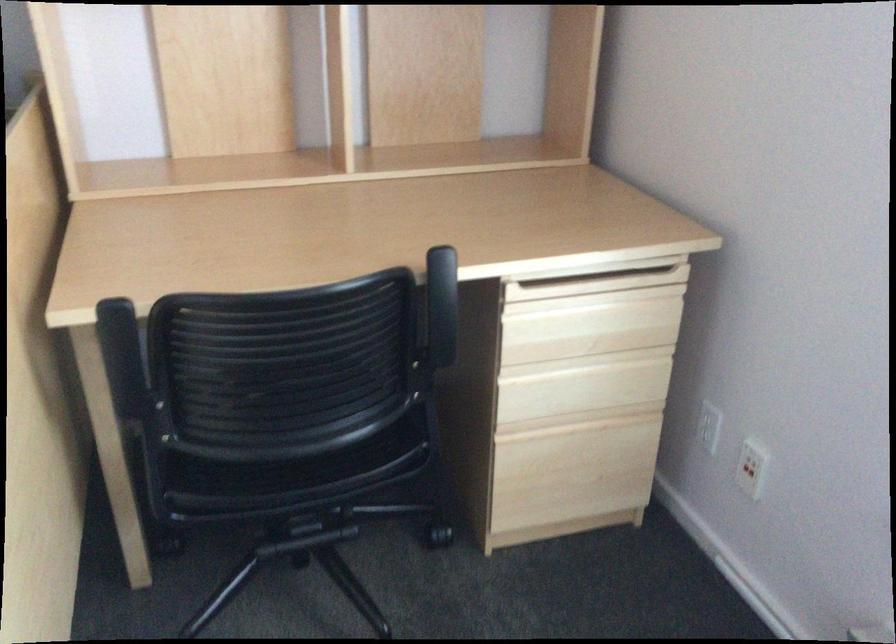
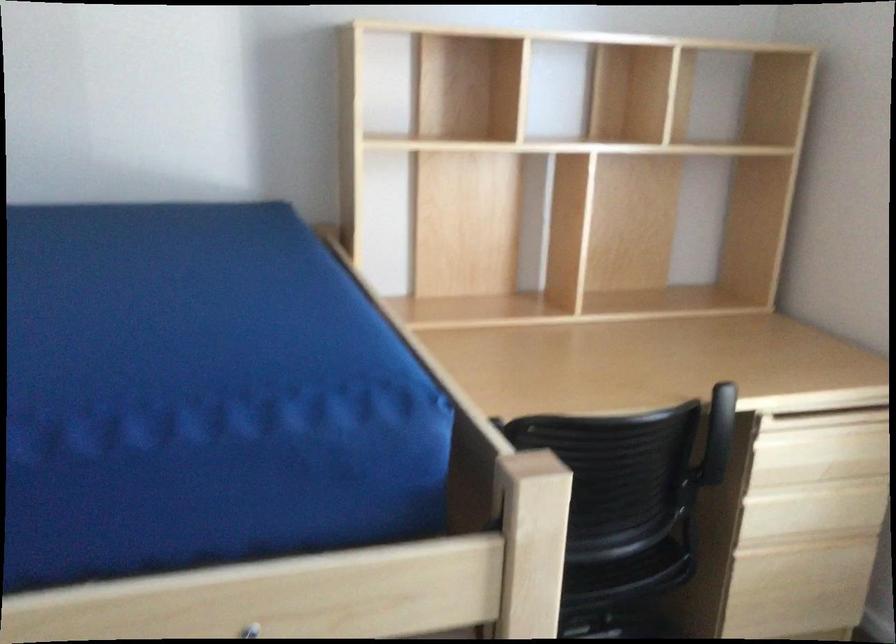
Which direction would the cameraman need to move to produce the second image?

The movement direction of the cameraman is left, backward.